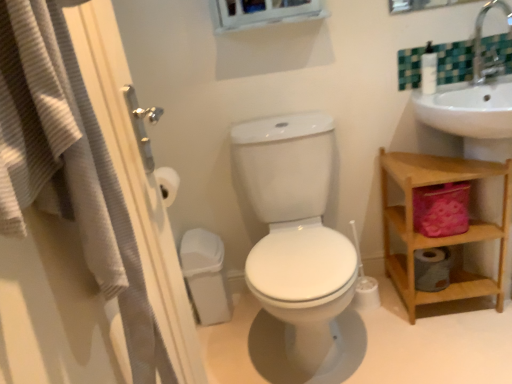
Question: Is white plastic soap dispenser at upper right oriented away from white textured screen door at left?

Choices:
 (A) yes
 (B) no

Answer: (B)

Question: Is white plastic soap dispenser at upper right far away from white textured screen door at left?

Choices:
 (A) no
 (B) yes

Answer: (B)

Question: Does white plastic soap dispenser at upper right have a larger size compared to white textured screen door at left?

Choices:
 (A) no
 (B) yes

Answer: (A)

Question: Is the position of white plastic soap dispenser at upper right more distant than that of white textured screen door at left?

Choices:
 (A) yes
 (B) no

Answer: (A)

Question: From a real-world perspective, is white plastic soap dispenser at upper right beneath white textured screen door at left?

Choices:
 (A) no
 (B) yes

Answer: (A)

Question: Could white textured screen door at left be considered to be inside white plastic soap dispenser at upper right?

Choices:
 (A) yes
 (B) no

Answer: (B)

Question: From the image's perspective, does white plastic soap dispenser at upper right appear higher than silver metallic faucet at upper right?

Choices:
 (A) yes
 (B) no

Answer: (B)

Question: Does white plastic soap dispenser at upper right contain silver metallic faucet at upper right?

Choices:
 (A) no
 (B) yes

Answer: (A)

Question: Are white plastic soap dispenser at upper right and silver metallic faucet at upper right far apart?

Choices:
 (A) yes
 (B) no

Answer: (B)

Question: Is the position of white plastic soap dispenser at upper right less distant than that of silver metallic faucet at upper right?

Choices:
 (A) no
 (B) yes

Answer: (A)

Question: Is the position of white plastic soap dispenser at upper right more distant than that of silver metallic faucet at upper right?

Choices:
 (A) no
 (B) yes

Answer: (B)

Question: Is white plastic soap dispenser at upper right outside of silver metallic faucet at upper right?

Choices:
 (A) yes
 (B) no

Answer: (A)

Question: Does wooden shelf at right have a greater height compared to white textured screen door at left?

Choices:
 (A) yes
 (B) no

Answer: (B)